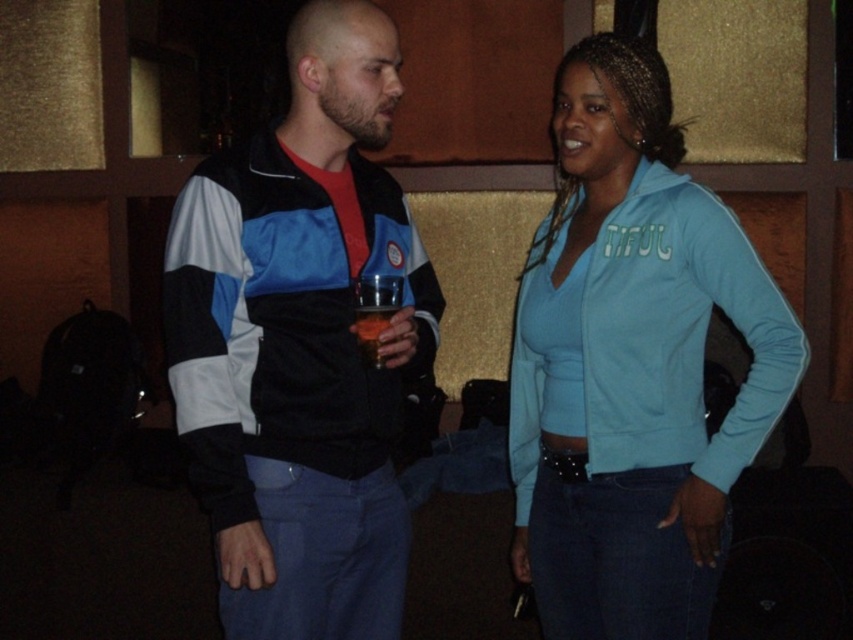
Question: Is matte black jacket at center to the right of translucent plastic cup at center from the viewer's perspective?

Choices:
 (A) no
 (B) yes

Answer: (A)

Question: Is matte black jacket at center positioned in front of light blue fleece jacket at center?

Choices:
 (A) no
 (B) yes

Answer: (B)

Question: Among these objects, which one is nearest to the camera?

Choices:
 (A) light blue fleece jacket at center
 (B) translucent plastic cup at center
 (C) matte black jacket at center

Answer: (C)

Question: Among these points, which one is farthest from the camera?

Choices:
 (A) (592, 320)
 (B) (392, 100)

Answer: (B)

Question: Which point is closer to the camera taking this photo?

Choices:
 (A) (369, 308)
 (B) (646, 451)

Answer: (A)

Question: Can you confirm if matte black jacket at center is smaller than light blue fleece jacket at center?

Choices:
 (A) no
 (B) yes

Answer: (B)